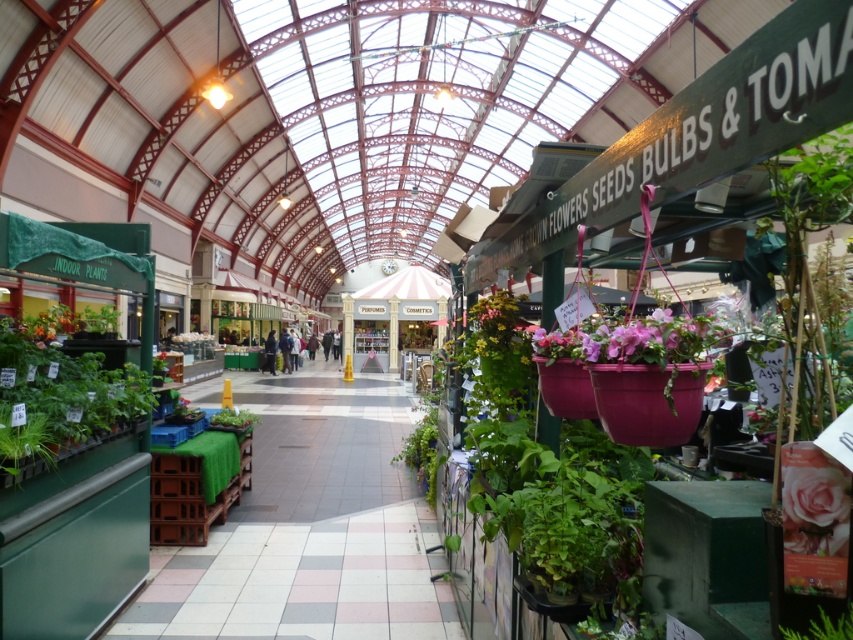
You are a customer at the flower market and want to buy both the pink matte flower pot at center and the pink matte rose at lower right. You need to know which one is taller. Can you tell me which one is taller?

The pink matte flower pot at center is taller than the pink matte rose at lower right.

You are a customer at the flower market and want to place a pink matte rose at lower right into a pink matte flower pot at center. Can you determine if the rose will fit into the pot based on their sizes?

The pink matte flower pot at center and pink matte rose at lower right are 28.65 inches apart, so the distance between them is sufficient for placing the rose into the pot.